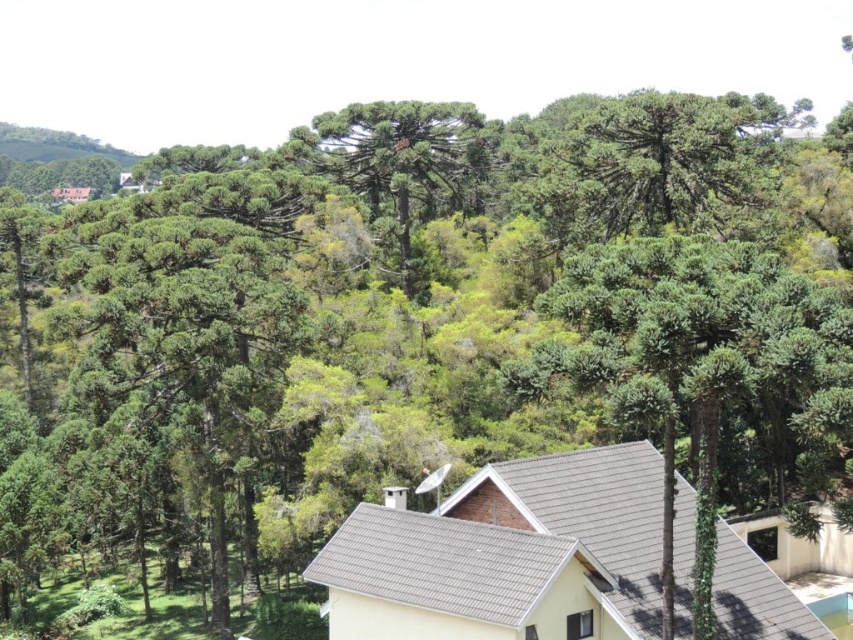
Does green leafy tree at center have a lesser width compared to green textured tree at center?

In fact, green leafy tree at center might be wider than green textured tree at center.

From the picture: Does green leafy tree at center appear on the right side of green textured tree at center?

Correct, you'll find green leafy tree at center to the right of green textured tree at center.

Does point (614, 390) come in front of point (364, 150)?

That is True.

What are the coordinates of `green leafy tree at center` in the screenshot? It's located at (700, 371).